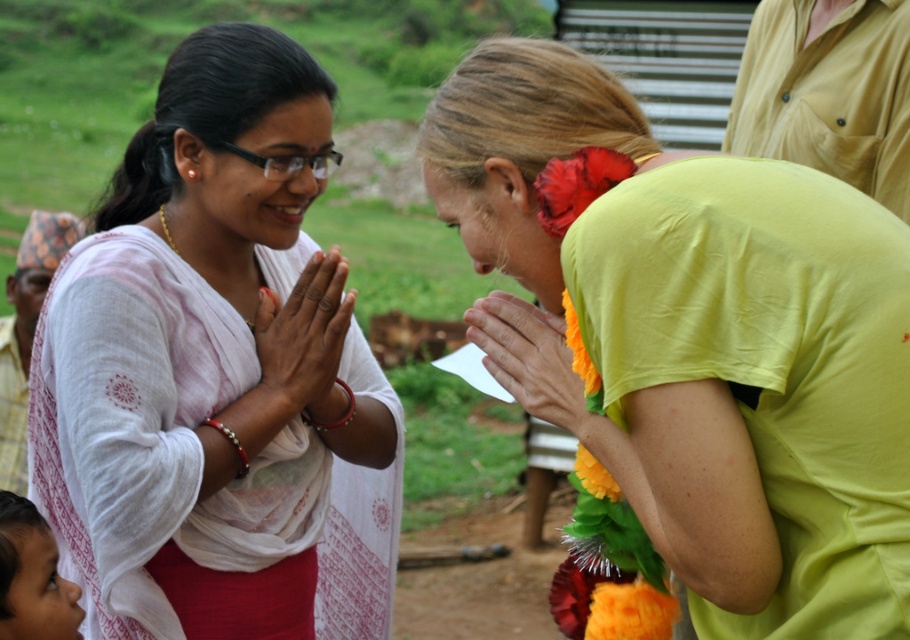
In the scene where two women are engaged in a cultural exchange outdoors, you need to determine if the white sheer sari at center will cover the smooth skin face at lower left. Based on their positions and sizes, will the sari cover the face?

The white sheer sari at center is much taller than the smooth skin face at lower left, so the sari will cover the face.

What is located at the coordinate point (206, 358) in the image?

The white sheer sari at center is located at the coordinate point (206, 358).

You are an artist trying to sketch this scene. You want to ensure that the proportions between the white sheer sari at center and the smooth skin face at lower left are accurate. Which object should you draw first to maintain proper scale?

The white sheer sari at center should be drawn first because it is larger in size than the smooth skin face at lower left, ensuring the scale is correct before adding smaller details.